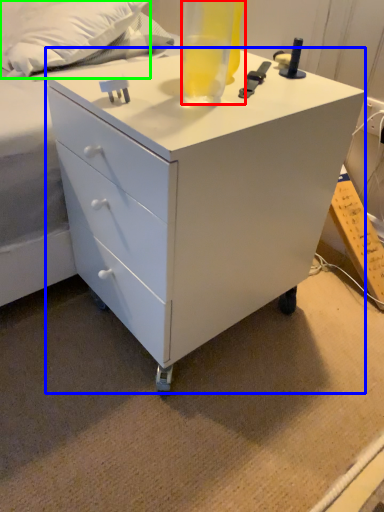
Question: Which object is positioned farthest from beverage (highlighted by a red box)? Select from chest of drawers (highlighted by a blue box) and pillow (highlighted by a green box).

Choices:
 (A) chest of drawers
 (B) pillow

Answer: (B)